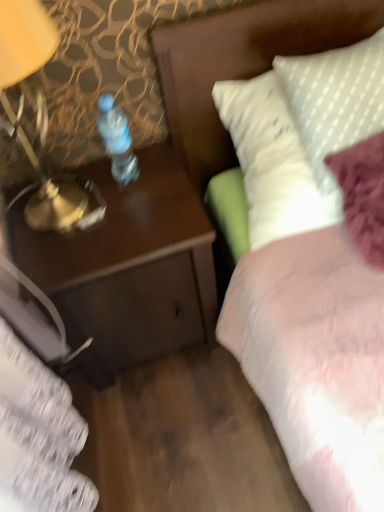
Where is `unoccupied region to the right of gold metallic lamp at left`? unoccupied region to the right of gold metallic lamp at left is located at coordinates (148, 200).